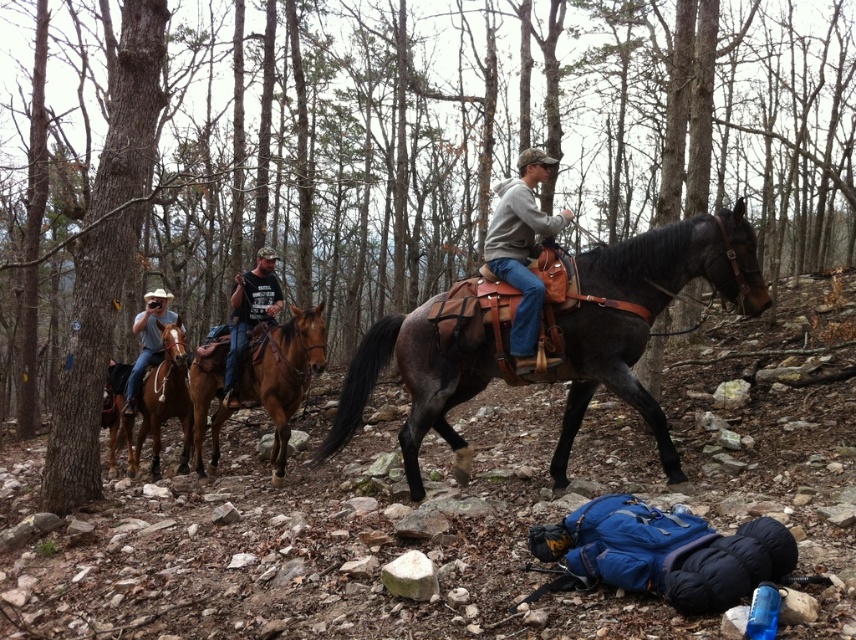
Question: Considering the relative positions of brushed metal horse at center and brown leather cowboy hat at left in the image provided, where is brushed metal horse at center located with respect to brown leather cowboy hat at left?

Choices:
 (A) left
 (B) right

Answer: (B)

Question: Which point appears farthest from the camera in this image?

Choices:
 (A) (153, 324)
 (B) (550, 236)
 (C) (325, 364)
 (D) (183, 337)

Answer: (A)

Question: Which point appears farthest from the camera in this image?

Choices:
 (A) (134, 384)
 (B) (247, 340)

Answer: (A)

Question: Which point is farther to the camera?

Choices:
 (A) (456, 381)
 (B) (278, 328)
 (C) (141, 385)

Answer: (C)

Question: Is shiny brown horse at center below brown leather saddle at center?

Choices:
 (A) yes
 (B) no

Answer: (B)

Question: Does shiny brown horse at center appear under brown leather cowboy hat at left?

Choices:
 (A) no
 (B) yes

Answer: (B)